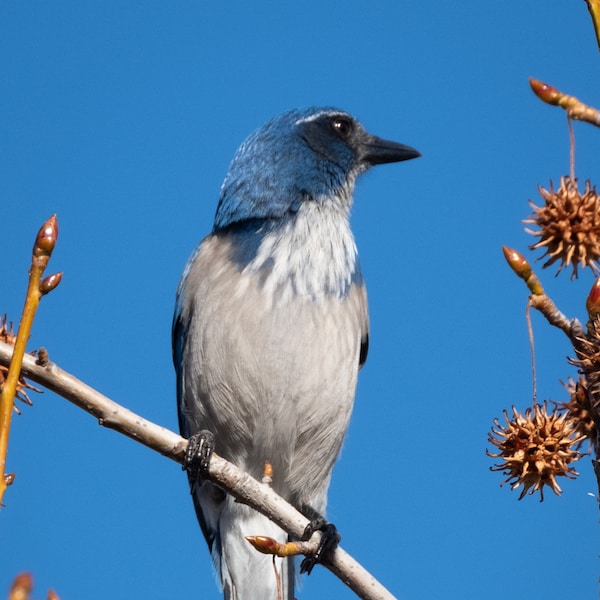
Identify the location of plant. This screenshot has width=600, height=600. (534, 450).